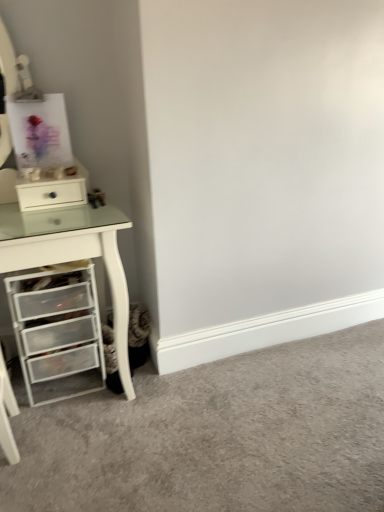
Question: From the image's perspective, is white glossy drawer at upper left under white plastic drawer unit at left?

Choices:
 (A) yes
 (B) no

Answer: (B)

Question: Considering the relative sizes of white glossy drawer at upper left and white plastic drawer unit at left in the image provided, is white glossy drawer at upper left bigger than white plastic drawer unit at left?

Choices:
 (A) no
 (B) yes

Answer: (A)

Question: Considering the relative positions of white glossy drawer at upper left and white plastic drawer unit at left in the image provided, is white glossy drawer at upper left to the left of white plastic drawer unit at left from the viewer's perspective?

Choices:
 (A) no
 (B) yes

Answer: (A)

Question: Considering the relative sizes of white glossy drawer at upper left and white plastic drawer unit at left in the image provided, is white glossy drawer at upper left smaller than white plastic drawer unit at left?

Choices:
 (A) yes
 (B) no

Answer: (A)

Question: Does white glossy drawer at upper left turn towards white plastic drawer unit at left?

Choices:
 (A) yes
 (B) no

Answer: (A)

Question: From a real-world perspective, is white glossy drawer at upper left positioned over white plastic drawer unit at left based on gravity?

Choices:
 (A) yes
 (B) no

Answer: (A)

Question: From a real-world perspective, is white glossy drawer at upper left beneath white plastic drawers at lower left?

Choices:
 (A) yes
 (B) no

Answer: (B)

Question: Would you say white glossy drawer at upper left contains white plastic drawers at lower left?

Choices:
 (A) yes
 (B) no

Answer: (B)

Question: Does white glossy drawer at upper left have a smaller size compared to white plastic drawers at lower left?

Choices:
 (A) yes
 (B) no

Answer: (A)

Question: From the image's perspective, is white glossy drawer at upper left on white plastic drawers at lower left?

Choices:
 (A) no
 (B) yes

Answer: (B)

Question: Could you tell me if white glossy drawer at upper left is facing white plastic drawers at lower left?

Choices:
 (A) no
 (B) yes

Answer: (A)

Question: From the image's perspective, would you say white glossy drawer at upper left is shown under white plastic drawers at lower left?

Choices:
 (A) no
 (B) yes

Answer: (A)

Question: Does white plastic drawers at lower left have a larger size compared to white plastic drawer unit at left?

Choices:
 (A) yes
 (B) no

Answer: (B)